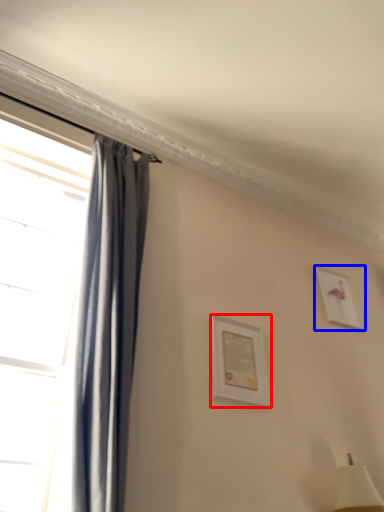
Question: Which object appears closest to the camera in this image, picture frame (highlighted by a red box) or picture frame (highlighted by a blue box)?

Choices:
 (A) picture frame
 (B) picture frame

Answer: (A)